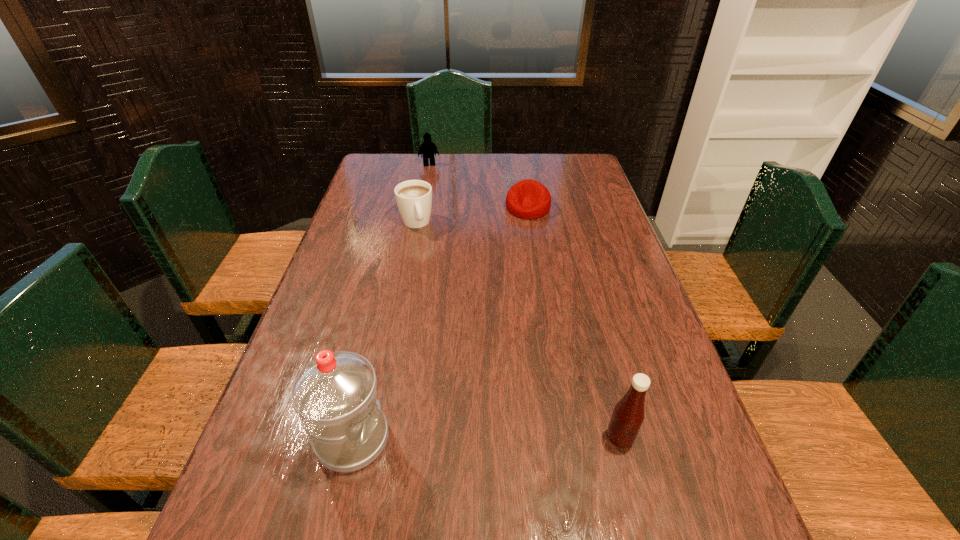
Where is `object located at the left edge`? object located at the left edge is located at coordinates (335, 396).

Identify the location of object that is positioned at the right edge. The width and height of the screenshot is (960, 540). (628, 415).

Where is `object at the near left corner`? Image resolution: width=960 pixels, height=540 pixels. object at the near left corner is located at coordinates (335, 396).

Find the location of a particular element. blank space at the far edge of the desktop is located at coordinates (430, 168).

Find the location of `vacant region at the near edge of the desktop`. vacant region at the near edge of the desktop is located at coordinates (418, 474).

Locate an element on the screen. This screenshot has height=540, width=960. vacant space at the left edge of the desktop is located at coordinates (323, 316).

This screenshot has width=960, height=540. In the image, there is a desktop. What are the coordinates of `vacant space at the right edge` in the screenshot? It's located at (682, 436).

Where is `vacant space at the far left corner`? vacant space at the far left corner is located at coordinates (376, 177).

What are the coordinates of `vacant area at the near right corner` in the screenshot? It's located at (714, 507).

You are a GUI agent. You are given a task and a screenshot of the screen. Output one action in this format:
    pyautogui.click(x=<x>, y=<y>)
    Task: Click on the vacant space that is in between the beanbag and the farthest object
    Image resolution: width=960 pixels, height=540 pixels.
    Given the screenshot: What is the action you would take?
    pyautogui.click(x=478, y=186)